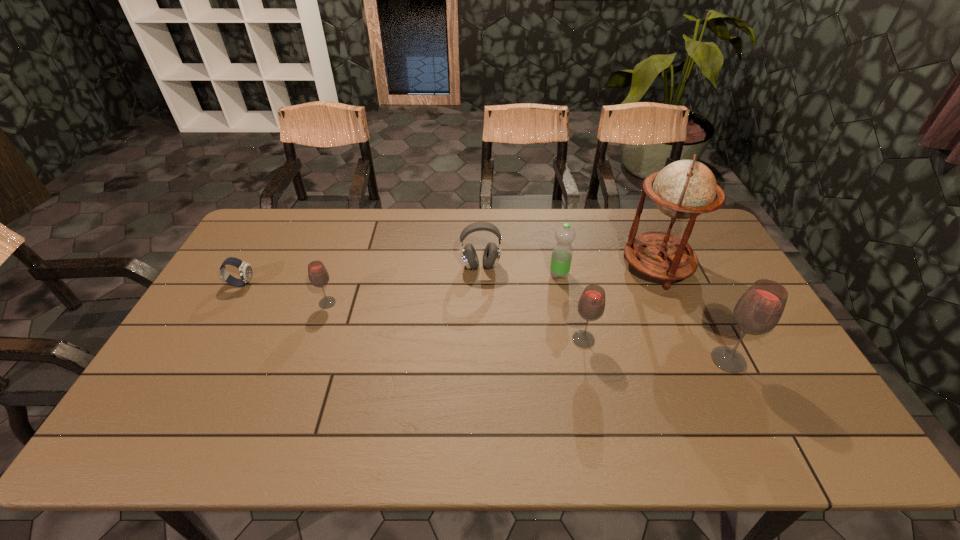
Find the location of a particular element. The image size is (960, 540). glass drink container identified as the third closest to the tallest object is located at coordinates (318, 275).

Locate an element on the screen. glass drink container that is the second closest to the globe is located at coordinates (758, 311).

I want to click on free space that satisfies the following two spatial constraints: 1. on the face of the sixth object from right to left; 2. on the left side of the shortest object, so click(230, 303).

At what (x,y) coordinates should I click in order to perform the action: click on blank area in the image that satisfies the following two spatial constraints: 1. on the surface of the tallest glass drink container; 2. on the right side of the tallest object. Please return your answer as a coordinate pair (x, y). Looking at the image, I should click on (697, 360).

Locate an element on the screen. This screenshot has height=540, width=960. free space that satisfies the following two spatial constraints: 1. on the ear cups of the second glass drink container from left to right; 2. on the left side of the headset is located at coordinates (481, 340).

Find the location of a particular element. Image resolution: width=960 pixels, height=540 pixels. vacant area in the image that satisfies the following two spatial constraints: 1. on the front side of the second shortest glass drink container; 2. on the left side of the water bottle is located at coordinates (571, 340).

The height and width of the screenshot is (540, 960). Identify the location of vacant space that satisfies the following two spatial constraints: 1. on the ear cups of the fifth object from right to left; 2. on the right side of the water bottle. (481, 274).

The image size is (960, 540). I want to click on free space in the image that satisfies the following two spatial constraints: 1. on the ear cups of the third object from left to right; 2. on the face of the leftmost object, so click(x=481, y=284).